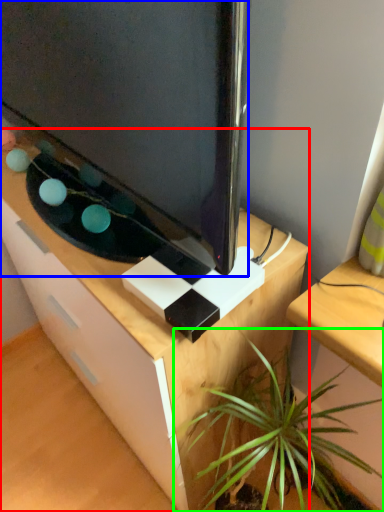
Question: Which is farther away from desk (highlighted by a red box)? television (highlighted by a blue box) or houseplant (highlighted by a green box)?

Choices:
 (A) television
 (B) houseplant

Answer: (A)